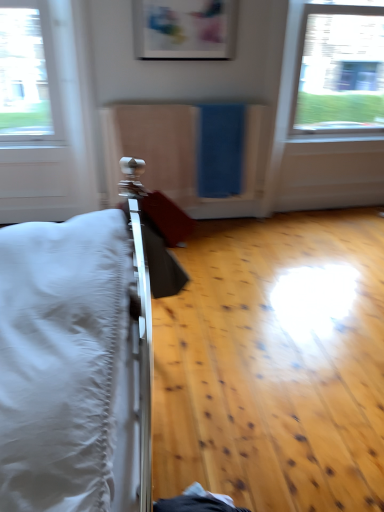
Question: Should I look upward or downward to see matte plastic picture frame at upper center?

Choices:
 (A) down
 (B) up

Answer: (B)